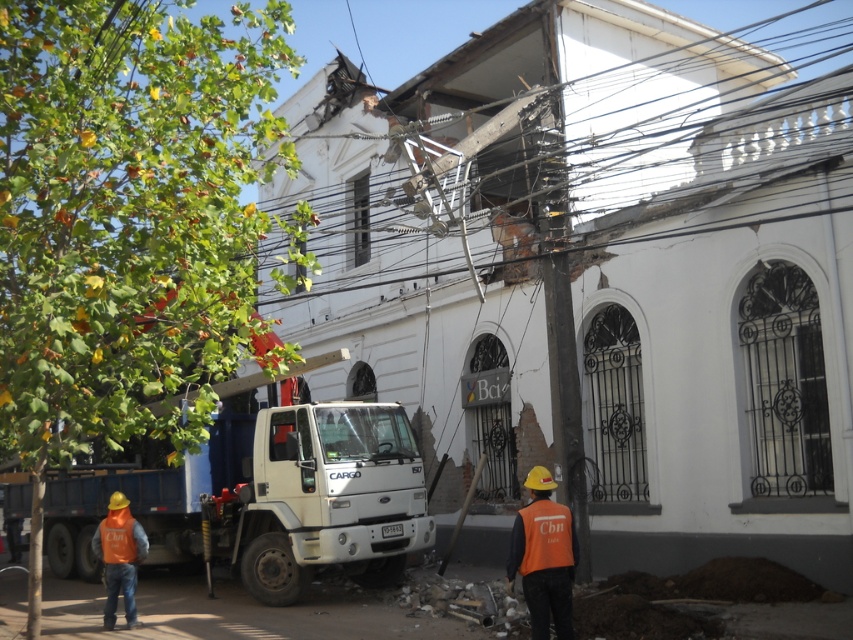
You are a drone operator trying to capture a photo of the construction site. You need to focus on both the point at coordinates point (131,584) and point (560,522). Which point should you adjust the focus on first to ensure both are in clear view?

Point (131,584) is further to the camera than point (560,522), so you should focus on point (131,584) first to ensure both points are in clear view.

You are a delivery driver who needs to park your truck behind the white matte truck at center without hitting the orange reflective vest at lower left. Can you safely park your truck there?

The white matte truck at center is not as tall as the orange reflective vest at lower left, so the orange reflective vest at lower left is taller. Therefore, you should avoid parking behind the white matte truck at center to prevent hitting the taller orange reflective vest at lower left.